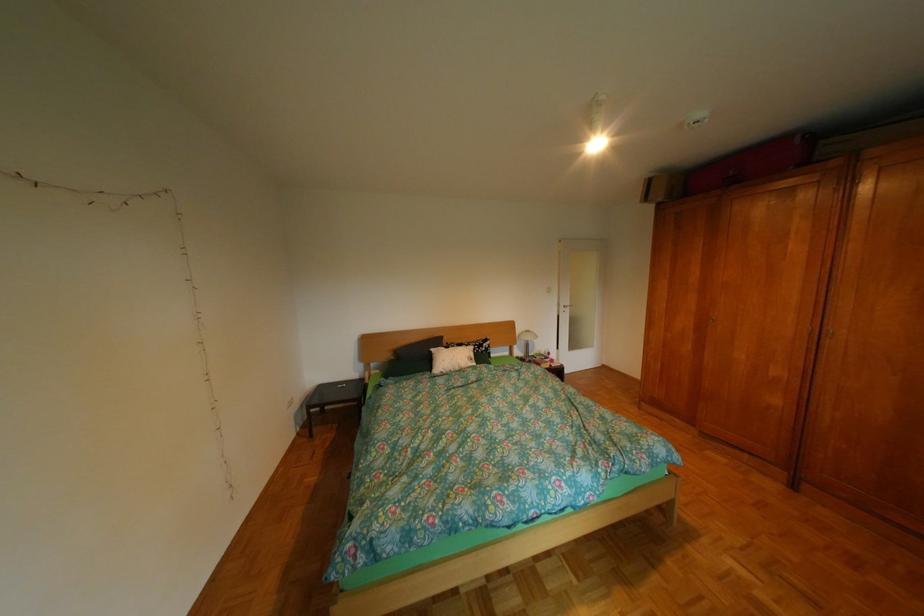
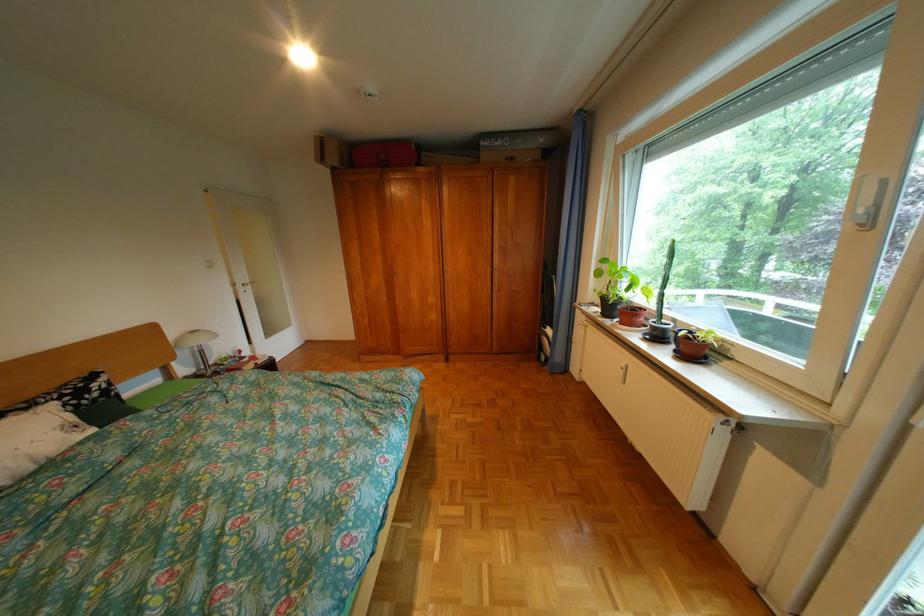
Locate, in the second image, the point that corresponds to point (574, 306) in the first image.

(248, 285)